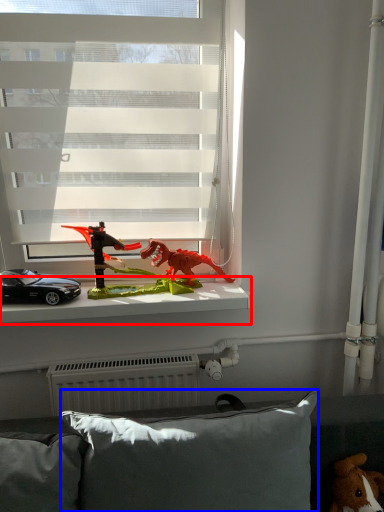
Question: Which object is further to the camera taking this photo, window sill (highlighted by a red box) or pillow (highlighted by a blue box)?

Choices:
 (A) window sill
 (B) pillow

Answer: (A)